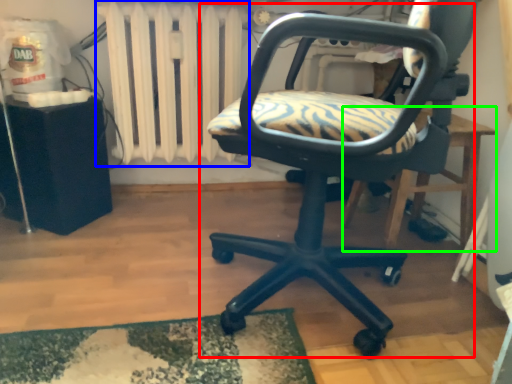
Question: Which object is the closest to the chair (highlighted by a red box)? Choose among these: radiator (highlighted by a blue box) or table (highlighted by a green box).

Choices:
 (A) radiator
 (B) table

Answer: (B)